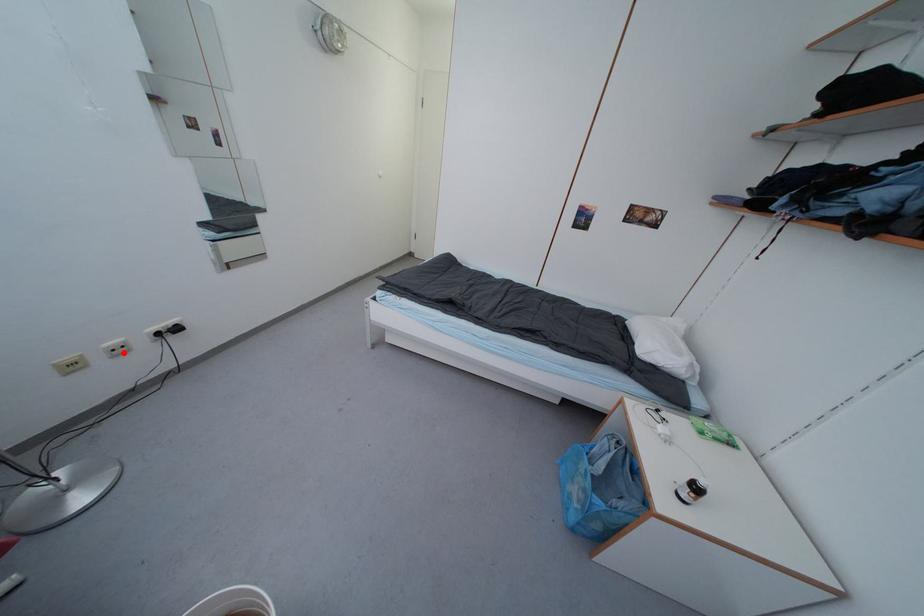
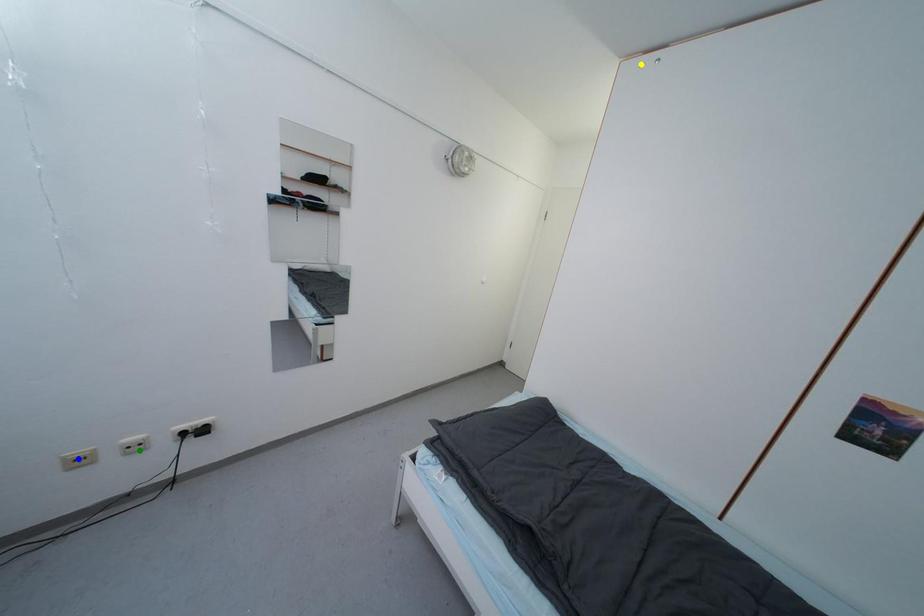
Question: I am providing you with two images of the same scene from different viewpoints. A red point is marked on the first image. You are given multiple points on the second image. Can you choose the point in image 2 that corresponds to the point in image 1?

Choices:
 (A) yellow point
 (B) blue point
 (C) green point

Answer: (C)